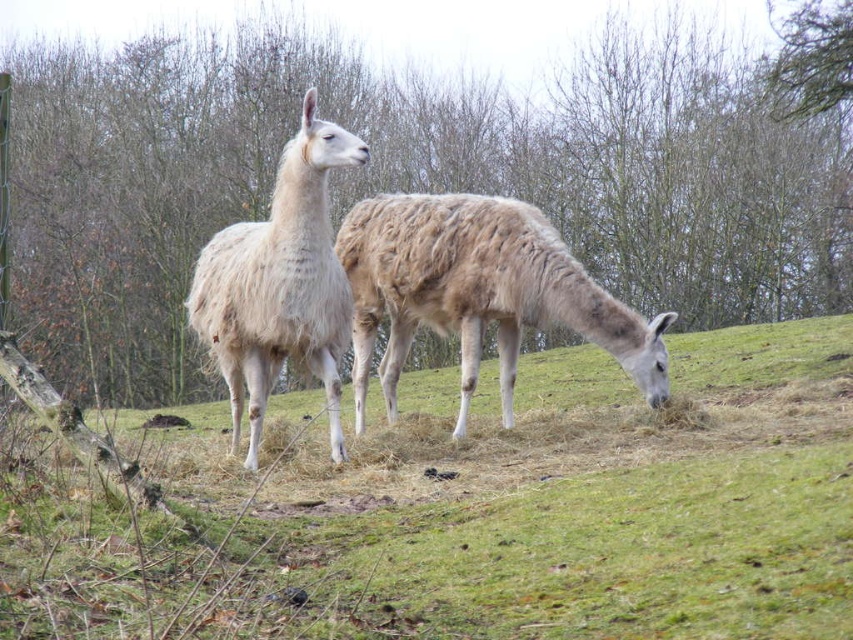
Which is below, brown leafy tree at upper center or white fluffy alpaca at center?

Positioned lower is white fluffy alpaca at center.

Does point (151, 140) come farther from viewer compared to point (329, 262)?

Yes, point (151, 140) is behind point (329, 262).

Identify the location of brown leafy tree at upper center. (407, 180).

Is point (265, 586) closer to camera compared to point (816, 141)?

Yes, point (265, 586) is closer to viewer.

The image size is (853, 640). Describe the element at coordinates (532, 504) in the screenshot. I see `green grassy at center` at that location.

Find the location of a particular element. green grassy at center is located at coordinates (532, 504).

Is brown leafy tree at upper center closer to camera compared to fuzzy beige camel at center?

Yes, it is in front of fuzzy beige camel at center.

In order to click on brown leafy tree at upper center in this screenshot , I will do `click(407, 180)`.

Between point (668, 307) and point (376, 317), which one is positioned behind?

The point (668, 307) is behind.

Locate an element on the screen. The image size is (853, 640). brown leafy tree at upper center is located at coordinates (407, 180).